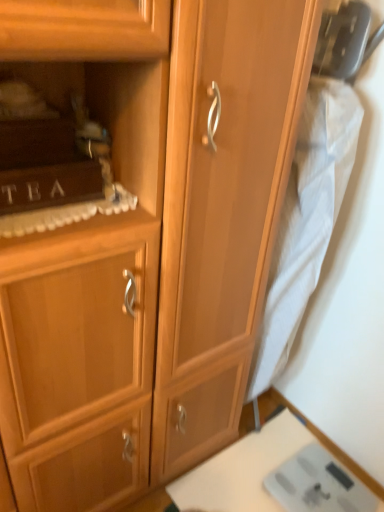
The image size is (384, 512). Identify the location of white glossy table at lower right. (264, 473).

This screenshot has height=512, width=384. Describe the element at coordinates (264, 473) in the screenshot. I see `white glossy table at lower right` at that location.

Where is `white glossy table at lower right`? white glossy table at lower right is located at coordinates (264, 473).